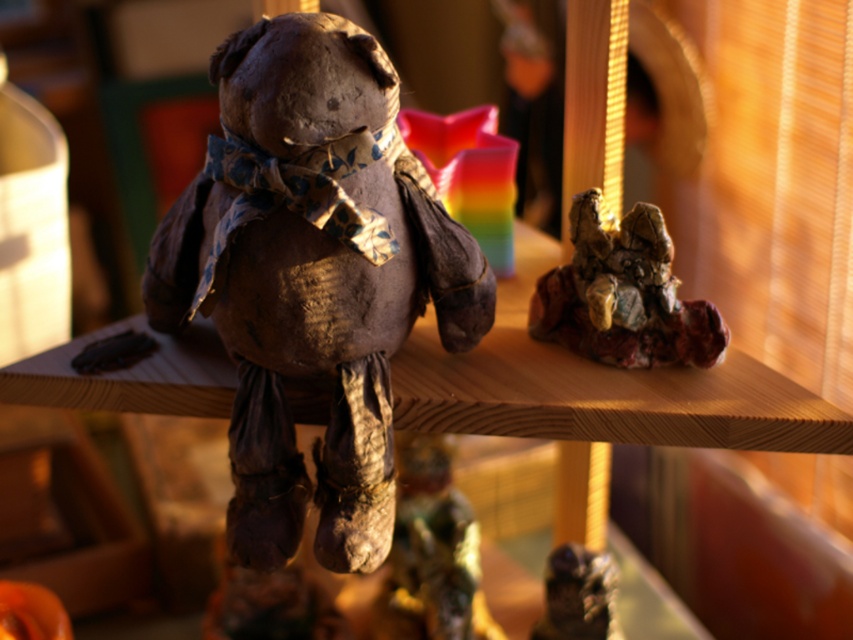
In the scene shown: Does crinkled paper sculpture at right appear over shiny metallic dinosaur at center?

Yes, crinkled paper sculpture at right is above shiny metallic dinosaur at center.

Can you confirm if crinkled paper sculpture at right is positioned below shiny metallic dinosaur at center?

Incorrect, crinkled paper sculpture at right is not positioned below shiny metallic dinosaur at center.

What do you see at coordinates (624, 294) in the screenshot?
I see `crinkled paper sculpture at right` at bounding box center [624, 294].

You are a GUI agent. You are given a task and a screenshot of the screen. Output one action in this format:
    pyautogui.click(x=<x>, y=<y>)
    Task: Click on the crinkled paper sculpture at right
    
    Given the screenshot: What is the action you would take?
    pyautogui.click(x=624, y=294)

What do you see at coordinates (624, 294) in the screenshot? I see `crinkled paper sculpture at right` at bounding box center [624, 294].

Between crinkled paper sculpture at right and matte orange pumpkin at lower left, which one has less height?

With less height is matte orange pumpkin at lower left.

Between point (601, 276) and point (16, 611), which one is positioned behind?

Positioned behind is point (16, 611).

Find the location of `crinkled paper sculpture at right`. crinkled paper sculpture at right is located at coordinates (624, 294).

Is crinkled paper sculpture at right thinner than rusty metal figurine at lower center?

No.

Can you confirm if crinkled paper sculpture at right is positioned to the left of rusty metal figurine at lower center?

No, crinkled paper sculpture at right is not to the left of rusty metal figurine at lower center.

The width and height of the screenshot is (853, 640). Identify the location of crinkled paper sculpture at right. (624, 294).